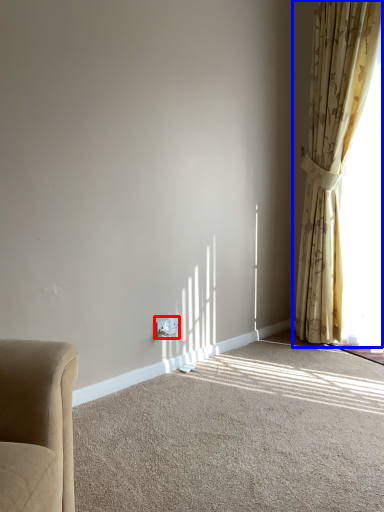
Question: Which point is closer to the camera, electric outlet (highlighted by a red box) or curtain (highlighted by a blue box)?

Choices:
 (A) electric outlet
 (B) curtain

Answer: (B)